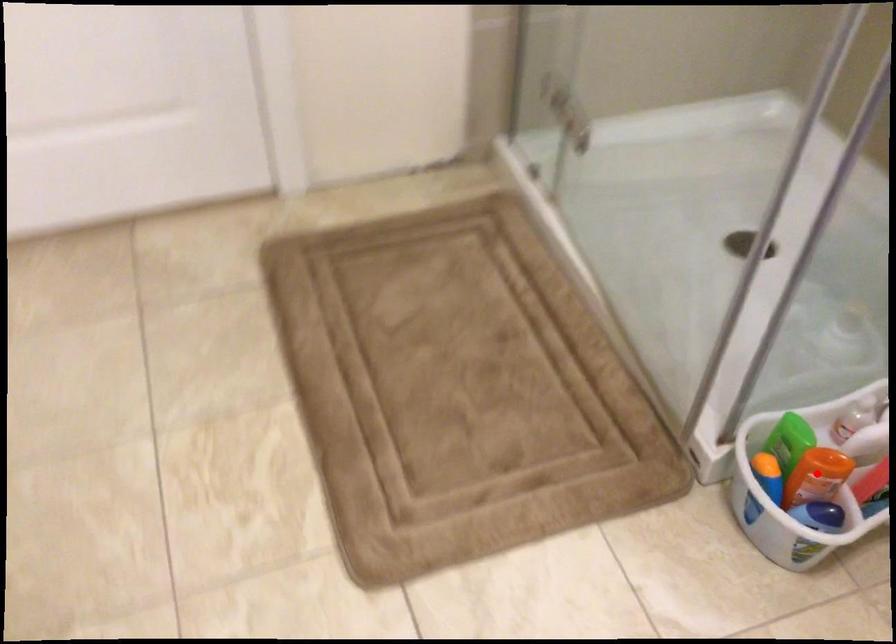
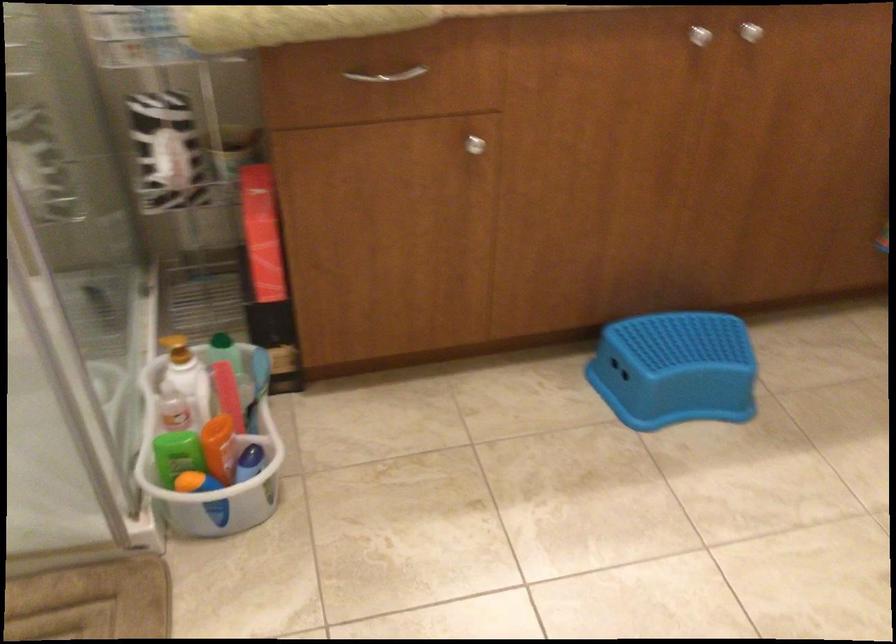
Question: I am providing you with two images of the same scene from different viewpoints. In image1, a red point is highlighted. Considering the same 3D point in image2, which of the following is correct?

Choices:
 (A) It is closer
 (B) It is farther

Answer: (B)